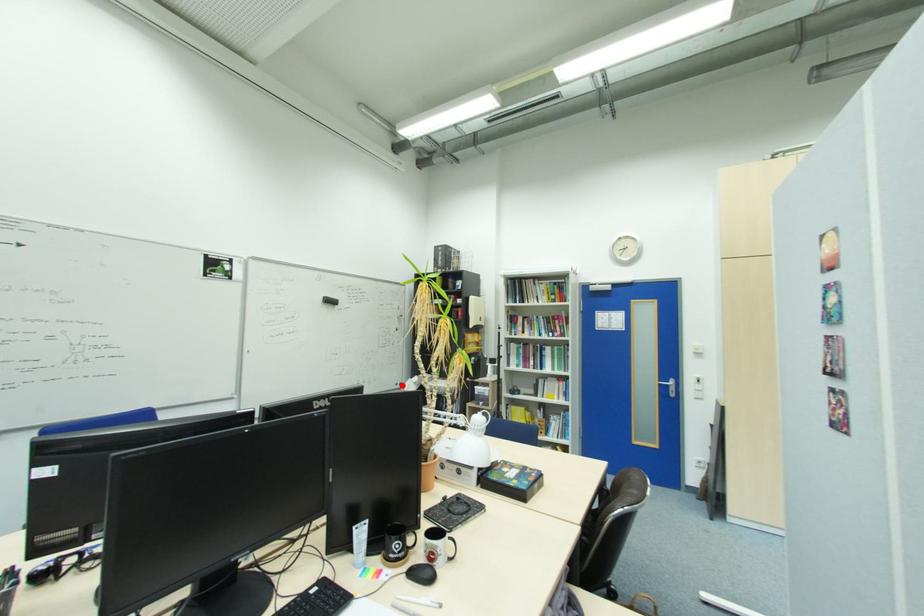
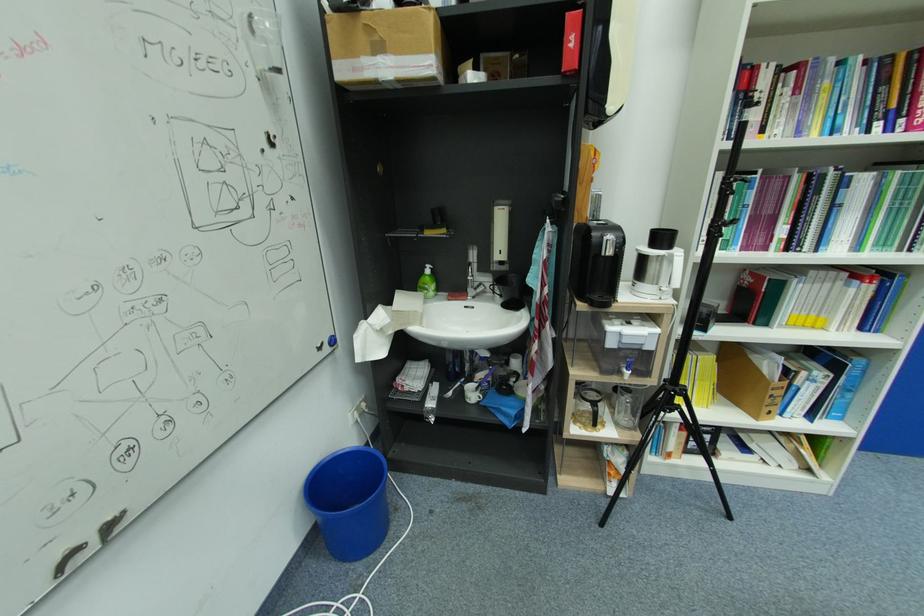
Question: I am providing you with two images of the same scene from different viewpoints. Image1 has a red point marked. In image2, the corresponding 3D location appears at what relative position? Reply with the corresponding letter.

Choices:
 (A) Closer
 (B) Farther

Answer: (A)